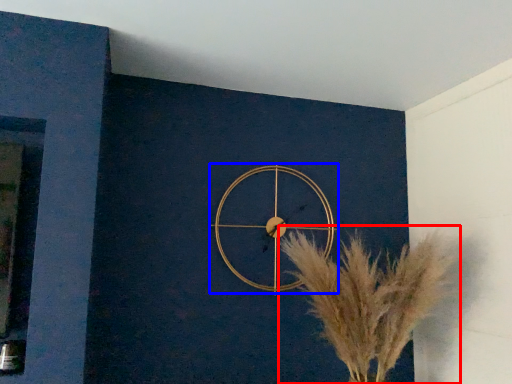
Question: Which of the following is the farthest to the observer, flower (highlighted by a red box) or wall clock (highlighted by a blue box)?

Choices:
 (A) flower
 (B) wall clock

Answer: (B)